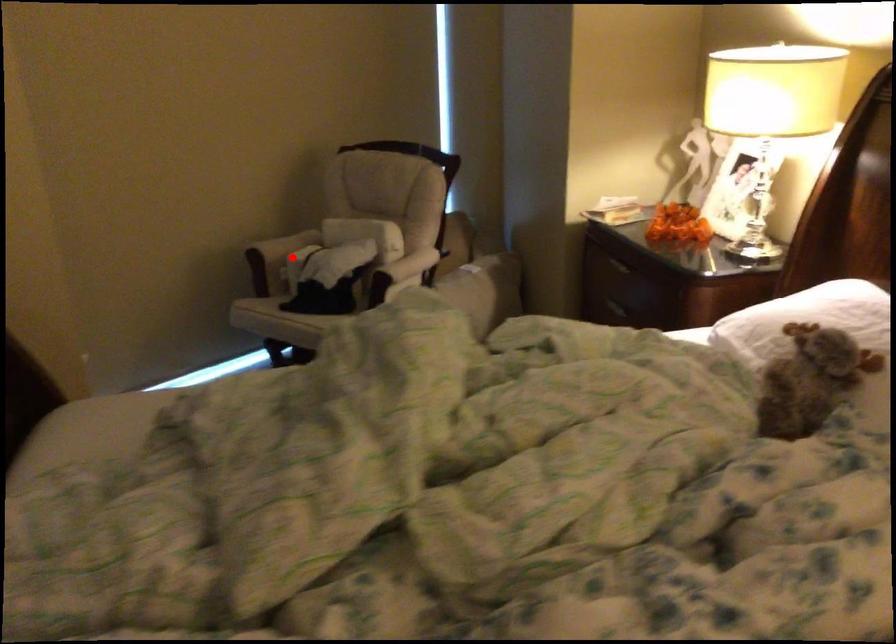
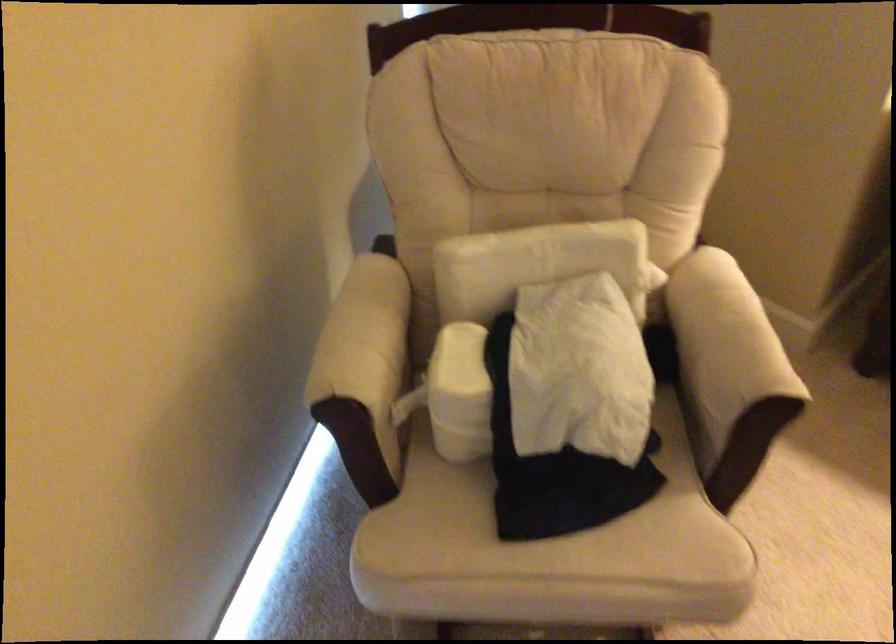
Question: I am providing you with two images of the same scene from different viewpoints. A red point is shown in image1. For the corresponding object point in image2, is it positioned nearer or farther from the camera?

Choices:
 (A) Nearer
 (B) Farther

Answer: (A)